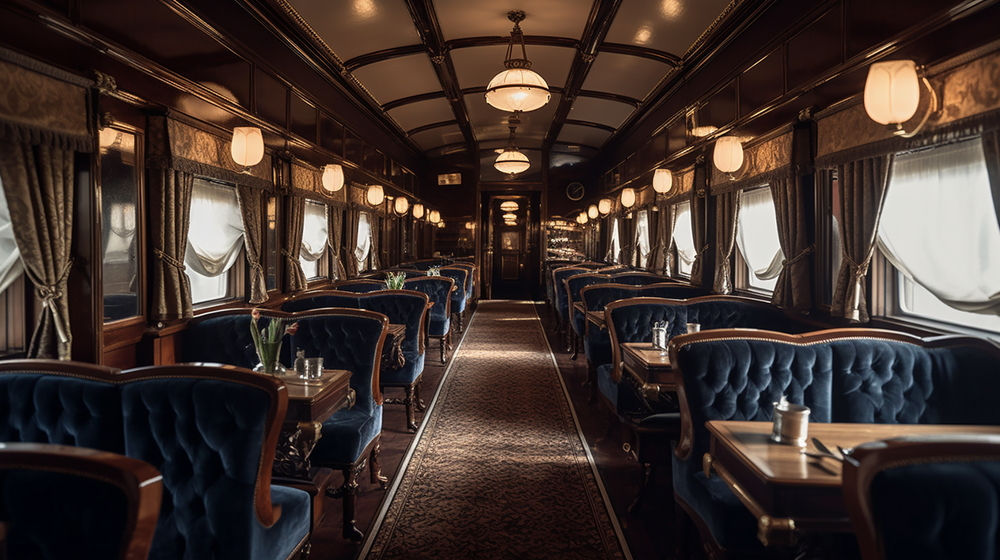
The width and height of the screenshot is (1000, 560). Identify the location of ceiling. coord(623,53), coord(442,122).